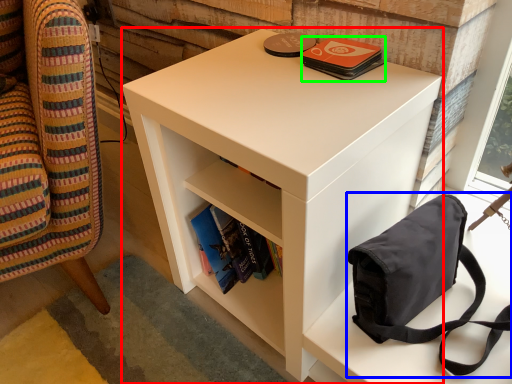
Question: Based on their relative distances, which object is nearer to nightstand (highlighted by a red box)? Choose from bag (highlighted by a blue box) and paperback book (highlighted by a green box).

Choices:
 (A) bag
 (B) paperback book

Answer: (A)